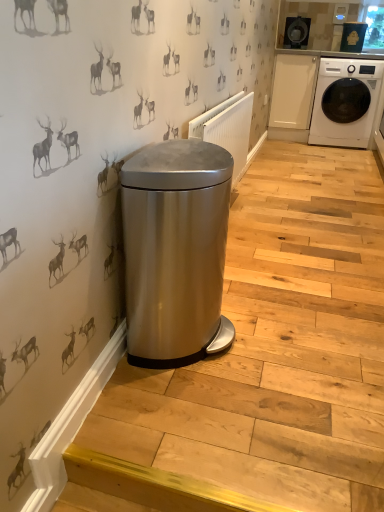
Describe the element at coordinates (92, 173) in the screenshot. I see `satin silver trash can at center` at that location.

Where is `stainless steel trash can at lower left`? stainless steel trash can at lower left is located at coordinates (268, 355).

This screenshot has height=512, width=384. Find the location of `satin silver trash can at center`. satin silver trash can at center is located at coordinates (175, 250).

In order to face satin silver trash can at center, should I rotate leftwards or rightwards?

It's best to rotate left around 0.198 degrees.

Image resolution: width=384 pixels, height=512 pixels. Identify the location of white glossy washing machine at right. (354, 110).

Between white glossy washing machine at right and satin silver radiator at center, which one has more height?

white glossy washing machine at right is taller.

Does white glossy washing machine at right have a greater width compared to satin silver radiator at center?

Indeed, white glossy washing machine at right has a greater width compared to satin silver radiator at center.

From the picture: Is white glossy washing machine at right located outside satin silver radiator at center?

Yes, white glossy washing machine at right is not within satin silver radiator at center.

I want to click on washing machine above the satin silver radiator at center (from the image's perspective), so click(x=354, y=110).

From the picture: In the image, is satin silver radiator at center positioned in front of or behind white glossy washing machine at right?

Visually, satin silver radiator at center is located in front of white glossy washing machine at right.

Is white glossy washing machine at right inside satin silver radiator at center?

Definitely not — white glossy washing machine at right is not inside satin silver radiator at center.

Between satin silver radiator at center and white glossy washing machine at right, which one has larger width?

Wider between the two is white glossy washing machine at right.

Is satin silver radiator at center turned away from white glossy washing machine at right?

No, satin silver radiator at center's orientation is not away from white glossy washing machine at right.

Which is closer to the camera, (47, 25) or (158, 270)?

The point (47, 25) is in front.

Considering the sizes of objects satin silver trash can at center and satin silver trash can at center in the image provided, who is smaller, satin silver trash can at center or satin silver trash can at center?

satin silver trash can at center.

From a real-world perspective, who is located lower, satin silver trash can at center or satin silver trash can at center?

satin silver trash can at center is physically lower.

Is satin silver trash can at center taller or shorter than satin silver trash can at center?

In the image, satin silver trash can at center appears to be shorter than satin silver trash can at center.

Can you tell me how much satin silver radiator at center and satin silver trash can at center differ in facing direction?

0.00898 degrees.

Is point (202, 123) more distant than point (209, 222)?

Yes, it is.

Considering the relative sizes of satin silver radiator at center and satin silver trash can at center in the image provided, is satin silver radiator at center taller than satin silver trash can at center?

In fact, satin silver radiator at center may be shorter than satin silver trash can at center.

Does satin silver radiator at center have a greater width compared to satin silver trash can at center?

Incorrect, the width of satin silver radiator at center does not surpass that of satin silver trash can at center.

Is the depth of satin silver trash can at center less than that of white glossy washing machine at right?

Yes, satin silver trash can at center is closer to the viewer.

Is satin silver trash can at center next to white glossy washing machine at right?

There is a gap between satin silver trash can at center and white glossy washing machine at right.

Which object is wider, satin silver trash can at center or white glossy washing machine at right?

Wider between the two is white glossy washing machine at right.

Measure the distance between satin silver trash can at center and white glossy washing machine at right.

The distance of satin silver trash can at center from white glossy washing machine at right is 11.63 feet.

Is stainless steel trash can at lower left inside satin silver radiator at center?

No, satin silver radiator at center does not contain stainless steel trash can at lower left.

Does satin silver radiator at center have a greater width compared to stainless steel trash can at lower left?

In fact, satin silver radiator at center might be narrower than stainless steel trash can at lower left.

Is satin silver radiator at center positioned with its back to stainless steel trash can at lower left?

No, satin silver radiator at center is not facing away from stainless steel trash can at lower left.

How different are the orientations of satin silver trash can at center and white glossy washing machine at right in degrees?

87 degrees.

In the image, is satin silver trash can at center positioned in front of or behind white glossy washing machine at right?

Visually, satin silver trash can at center is located in front of white glossy washing machine at right.

Consider the image. Is satin silver trash can at center in contact with white glossy washing machine at right?

satin silver trash can at center is not next to white glossy washing machine at right, and they're not touching.

Where is `washing machine above the satin silver radiator at center (from a real-world perspective)`? washing machine above the satin silver radiator at center (from a real-world perspective) is located at coordinates (354, 110).

Identify the location of washing machine behind the satin silver radiator at center. The image size is (384, 512). (354, 110).

Estimate the real-world distances between objects in this image. Which object is closer to satin silver trash can at center, stainless steel trash can at lower left or satin silver radiator at center?

stainless steel trash can at lower left.

Based on their spatial positions, is satin silver radiator at center or satin silver trash can at center closer to satin silver trash can at center?

Among the two, satin silver trash can at center is located nearer to satin silver trash can at center.

Looking at the image, which one is located closer to satin silver trash can at center, white glossy washing machine at right or satin silver radiator at center?

satin silver radiator at center lies closer to satin silver trash can at center than the other object.

Based on the photo, when comparing their distances from satin silver trash can at center, does satin silver radiator at center or satin silver trash can at center seem further?

satin silver radiator at center.

Estimate the real-world distances between objects in this image. Which object is further from satin silver radiator at center, satin silver trash can at center or satin silver trash can at center?

satin silver trash can at center is further to satin silver radiator at center.

Considering their positions, is satin silver trash can at center positioned further to white glossy washing machine at right than stainless steel trash can at lower left?

satin silver trash can at center is positioned further to the anchor white glossy washing machine at right.

When comparing their distances from stainless steel trash can at lower left, does satin silver trash can at center or satin silver trash can at center seem closer?

satin silver trash can at center lies closer to stainless steel trash can at lower left than the other object.

Estimate the real-world distances between objects in this image. Which object is closer to satin silver radiator at center, satin silver trash can at center or white glossy washing machine at right?

The object closer to satin silver radiator at center is satin silver trash can at center.

Where is `water heater between stainless steel trash can at lower left and white glossy washing machine at right in the front-back direction`? The width and height of the screenshot is (384, 512). water heater between stainless steel trash can at lower left and white glossy washing machine at right in the front-back direction is located at coordinates (175, 250).

Identify the location of radiator between satin silver trash can at center and white glossy washing machine at right from front to back. The width and height of the screenshot is (384, 512). (227, 128).

At what (x,y) coordinates should I click in order to perform the action: click on radiator between stainless steel trash can at lower left and white glossy washing machine at right from front to back. Please return your answer as a coordinate pair (x, y). The height and width of the screenshot is (512, 384). Looking at the image, I should click on (227, 128).

At what (x,y) coordinates should I click in order to perform the action: click on water heater located between satin silver trash can at center and white glossy washing machine at right in the depth direction. Please return your answer as a coordinate pair (x, y). The height and width of the screenshot is (512, 384). Looking at the image, I should click on (x=175, y=250).